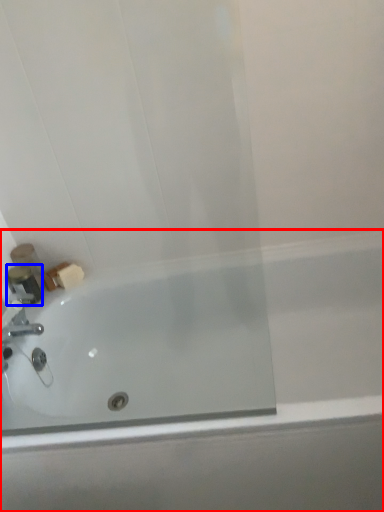
Question: Among these objects, which one is farthest to the camera, bathtub (highlighted by a red box) or toiletry (highlighted by a blue box)?

Choices:
 (A) bathtub
 (B) toiletry

Answer: (B)